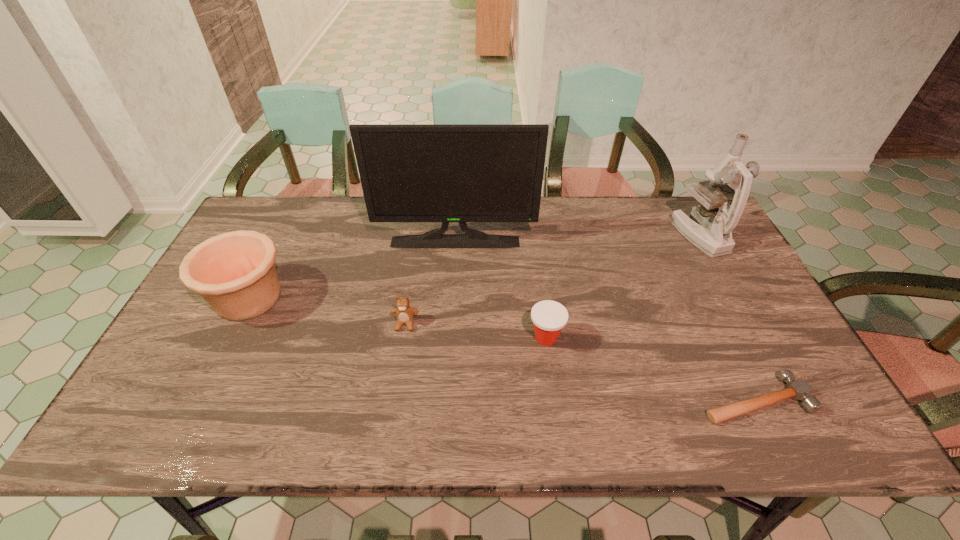
Locate an element on the screen. empty location between the teddy bear and the pottery is located at coordinates (327, 310).

The width and height of the screenshot is (960, 540). What are the coordinates of `vacant region between the Dixie cup and the monitor` in the screenshot? It's located at (500, 289).

Where is `vacant region between the microscope and the nearest object`? vacant region between the microscope and the nearest object is located at coordinates (727, 317).

Find the location of a particular element. The height and width of the screenshot is (540, 960). vacant space in between the nearest object and the teddy bear is located at coordinates (580, 361).

At what (x,y) coordinates should I click in order to perform the action: click on empty location between the nearest object and the monitor. Please return your answer as a coordinate pair (x, y). Looking at the image, I should click on (605, 320).

You are a GUI agent. You are given a task and a screenshot of the screen. Output one action in this format:
    pyautogui.click(x=<x>, y=<y>)
    Task: Click on the empty location between the teddy bear and the microscope
    This screenshot has height=540, width=960.
    Given the screenshot: What is the action you would take?
    pyautogui.click(x=552, y=279)

Identify the location of object that can be found as the second closest to the teddy bear. The height and width of the screenshot is (540, 960). [x=549, y=317].

Identify which object is the closest to the pottery. Please provide its 2D coordinates. Your answer should be formatted as a tuple, i.e. [(x, y)], where the tuple contains the x and y coordinates of a point satisfying the conditions above.

[(445, 173)]

I want to click on free region that satisfies the following two spatial constraints: 1. on the front-facing side of the Dixie cup; 2. on the right side of the monitor, so click(449, 338).

This screenshot has width=960, height=540. What are the coordinates of `free spot that satisfies the following two spatial constraints: 1. on the front-facing side of the monitor; 2. on the right side of the hammer` in the screenshot? It's located at (445, 399).